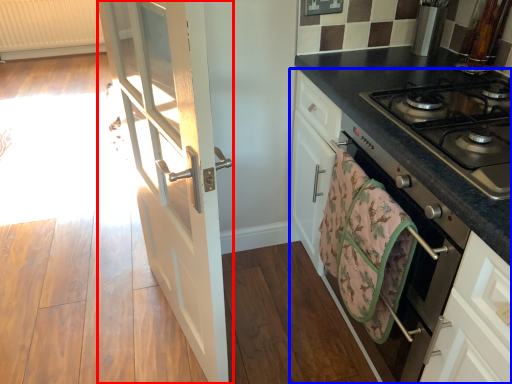
Question: Which object appears closest to the camera in this image, door (highlighted by a red box) or cabinetry (highlighted by a blue box)?

Choices:
 (A) door
 (B) cabinetry

Answer: (B)